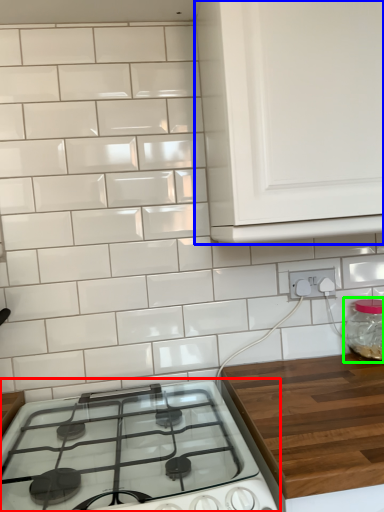
Question: Estimate the real-world distances between objects in this image. Which object is farther from gas stove (highlighted by a red box), cabinetry (highlighted by a blue box) or glass jar (highlighted by a green box)?

Choices:
 (A) cabinetry
 (B) glass jar

Answer: (B)